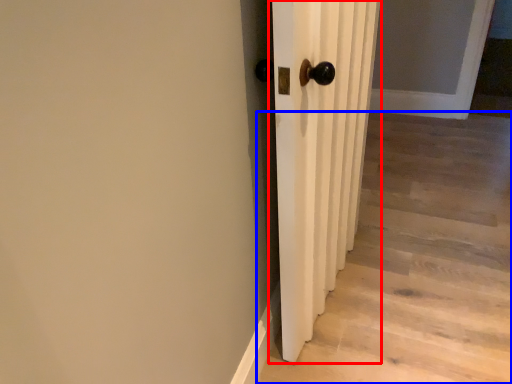
Question: Among these objects, which one is farthest to the camera, door (highlighted by a red box) or stairwell (highlighted by a blue box)?

Choices:
 (A) door
 (B) stairwell

Answer: (B)